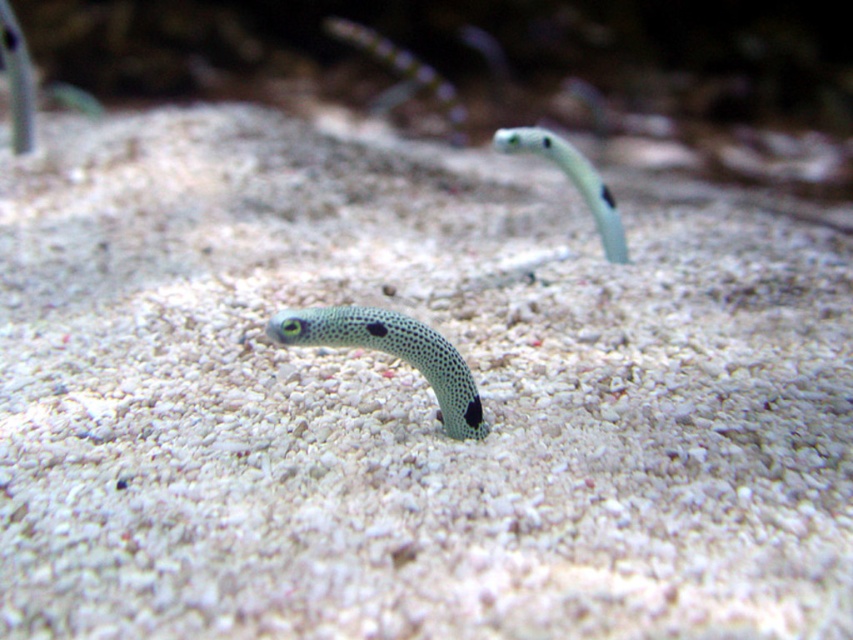
Does speckled green snake at center have a lesser width compared to green spotted snake at center?

Correct, speckled green snake at center's width is less than green spotted snake at center's.

Does speckled green snake at center have a greater height compared to green spotted snake at center?

In fact, speckled green snake at center may be shorter than green spotted snake at center.

Describe the element at coordinates (392, 355) in the screenshot. The image size is (853, 640). I see `speckled green snake at center` at that location.

The height and width of the screenshot is (640, 853). Find the location of `speckled green snake at center`. speckled green snake at center is located at coordinates (392, 355).